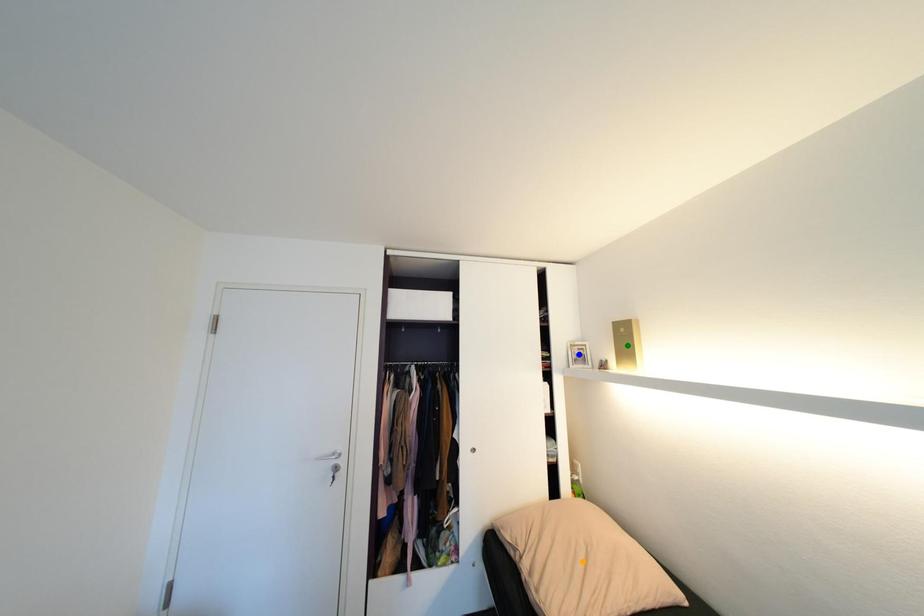
Looking at this image, order these from nearest to farthest:
orange point
blue point
green point

orange point → blue point → green point